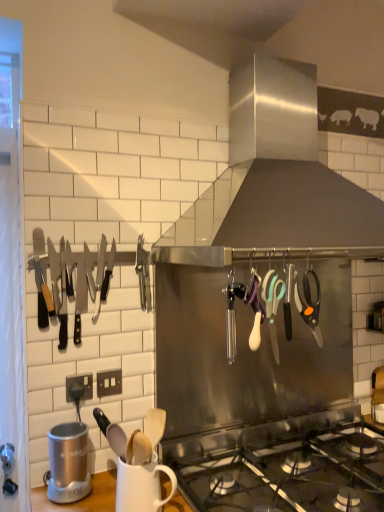
Question: From a real-world perspective, is orange-handled scissors at center-right, positioned as the first scissors in right-to-left order, located higher than silver metallic blender at lower left?

Choices:
 (A) yes
 (B) no

Answer: (A)

Question: Can you confirm if orange-handled scissors at center-right, the 2th scissors viewed from the left, is wider than silver metallic blender at lower left?

Choices:
 (A) yes
 (B) no

Answer: (B)

Question: Does orange-handled scissors at center-right, the 2th scissors viewed from the left, have a smaller size compared to silver metallic blender at lower left?

Choices:
 (A) no
 (B) yes

Answer: (B)

Question: Does orange-handled scissors at center-right, the 2th scissors viewed from the left, have a lesser height compared to silver metallic blender at lower left?

Choices:
 (A) yes
 (B) no

Answer: (B)

Question: Is silver metallic blender at lower left inside orange-handled scissors at center-right, positioned as the first scissors in right-to-left order?

Choices:
 (A) yes
 (B) no

Answer: (B)

Question: Is orange-handled scissors at center-right, the 2th scissors viewed from the left, positioned in front of silver metallic blender at lower left?

Choices:
 (A) no
 (B) yes

Answer: (B)

Question: Can we say orange-handled scissors at center-right, the 2th scissors viewed from the left, lies outside stainless steel knives at left?

Choices:
 (A) no
 (B) yes

Answer: (B)

Question: From the image's perspective, is orange-handled scissors at center-right, the 2th scissors viewed from the left, on top of stainless steel knives at left?

Choices:
 (A) yes
 (B) no

Answer: (B)

Question: Is orange-handled scissors at center-right, the 2th scissors viewed from the left, behind stainless steel knives at left?

Choices:
 (A) yes
 (B) no

Answer: (B)

Question: Does orange-handled scissors at center-right, positioned as the first scissors in right-to-left order, have a greater height compared to stainless steel knives at left?

Choices:
 (A) yes
 (B) no

Answer: (B)

Question: Does orange-handled scissors at center-right, positioned as the first scissors in right-to-left order, have a lesser height compared to stainless steel knives at left?

Choices:
 (A) yes
 (B) no

Answer: (A)

Question: Considering the relative positions of orange-handled scissors at center-right, positioned as the first scissors in right-to-left order, and stainless steel knives at left in the image provided, is orange-handled scissors at center-right, positioned as the first scissors in right-to-left order, in front of stainless steel knives at left?

Choices:
 (A) no
 (B) yes

Answer: (B)

Question: Does silver metallic blender at lower left turn towards white matte mug at lower center?

Choices:
 (A) yes
 (B) no

Answer: (B)